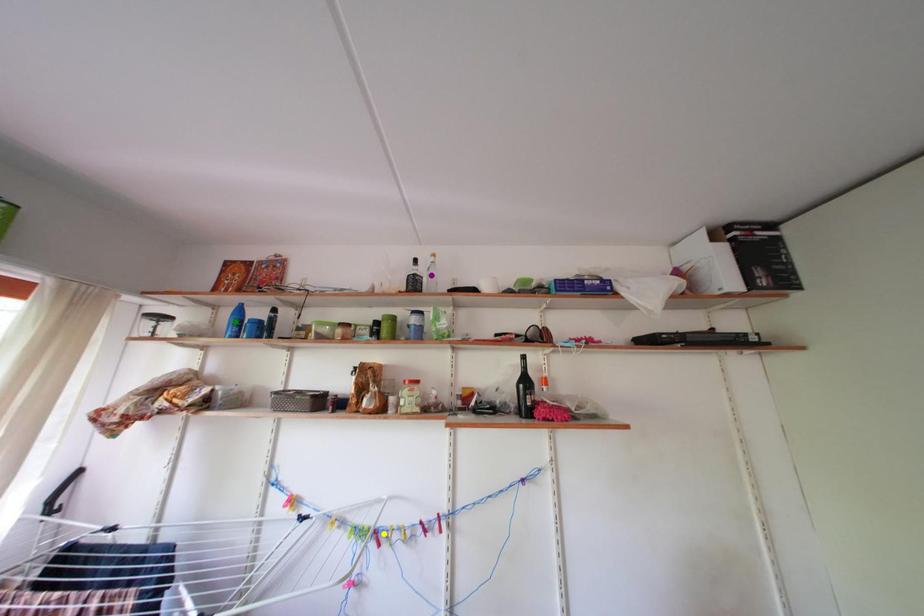
Order these from nearest to farthest:
green point, yellow point, purple point

1. yellow point
2. green point
3. purple point